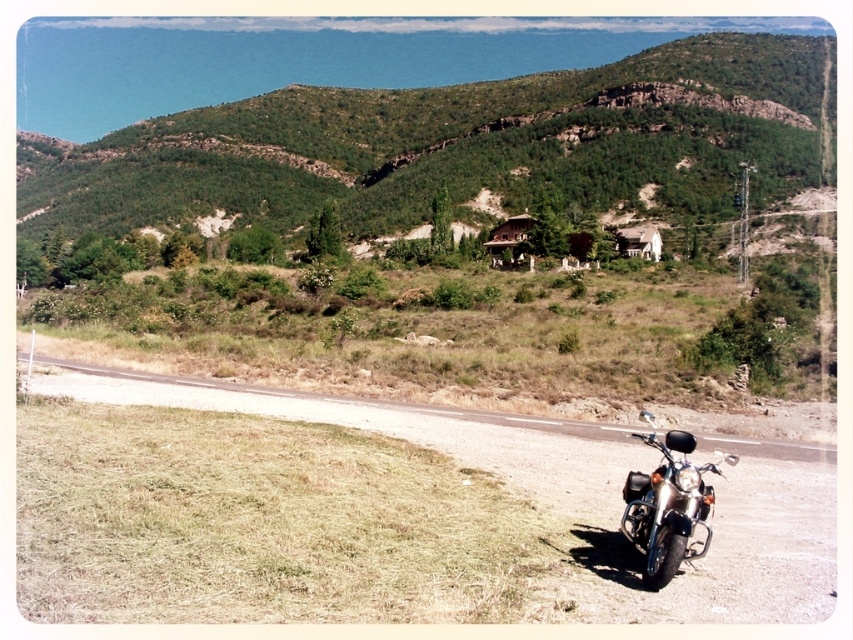
You are standing at the top of the hill and want to reach the shiny chrome motorcycle at lower right and the white wooden hut at center. Which one is closer to you?

The shiny chrome motorcycle at lower right is closer to you than the white wooden hut at center.

You are a delivery driver who needs to turn around your vehicle on the gravel road at lower right. Considering the presence of the shiny chrome motorcycle at lower right, can you safely make a U turn here?

The gravel road at lower right is wider than the shiny chrome motorcycle at lower right, so yes, you can safely make a U turn here as there is enough space.